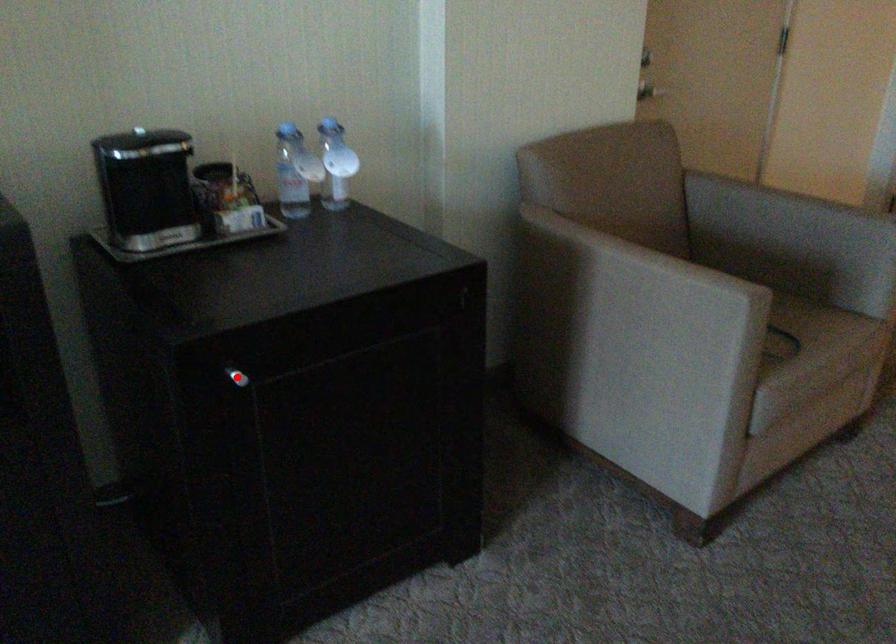
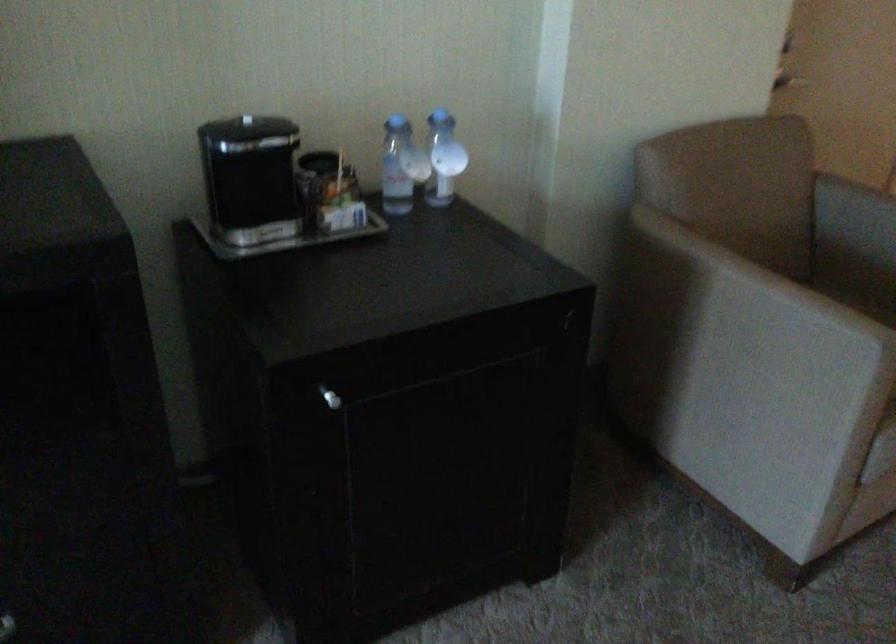
The point at the highlighted location is marked in the first image. Where is the corresponding point in the second image?

(330, 398)